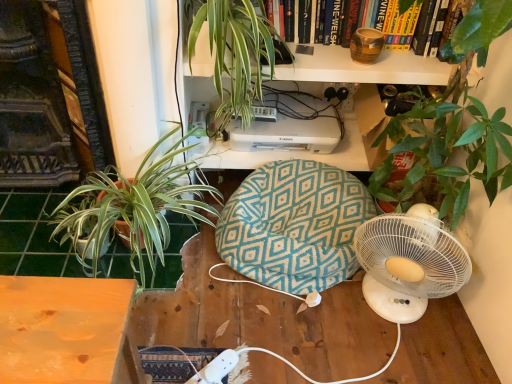
Locate an element on the screen. space that is in front of teal fabric bean bag at center is located at coordinates (287, 339).